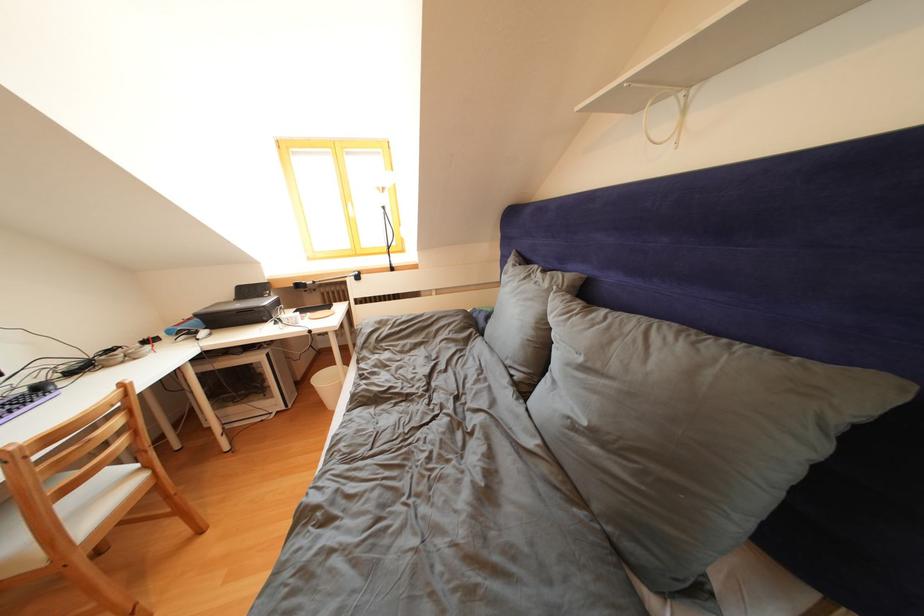
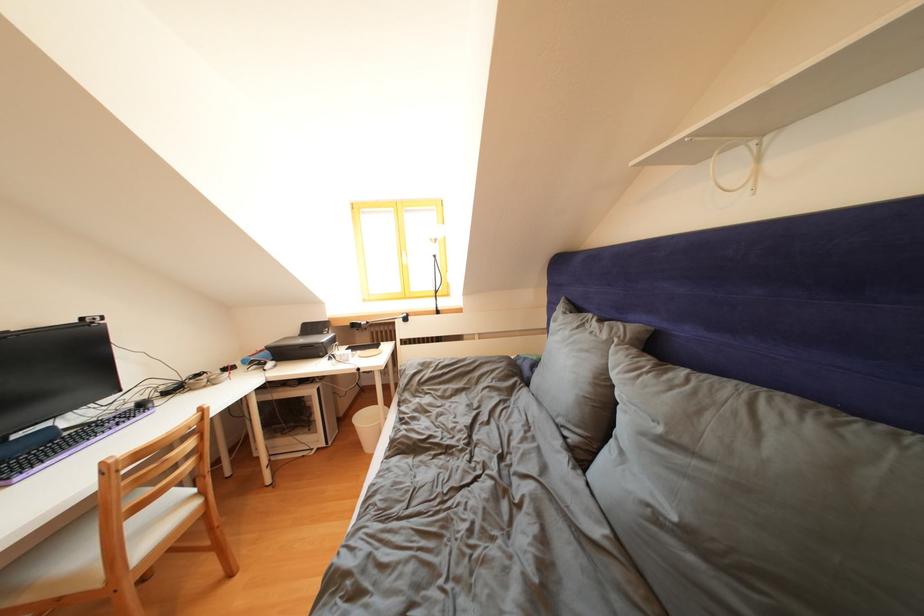
Question: How did the camera likely rotate?

Choices:
 (A) Left
 (B) Right
 (C) Up
 (D) Down

Answer: (C)